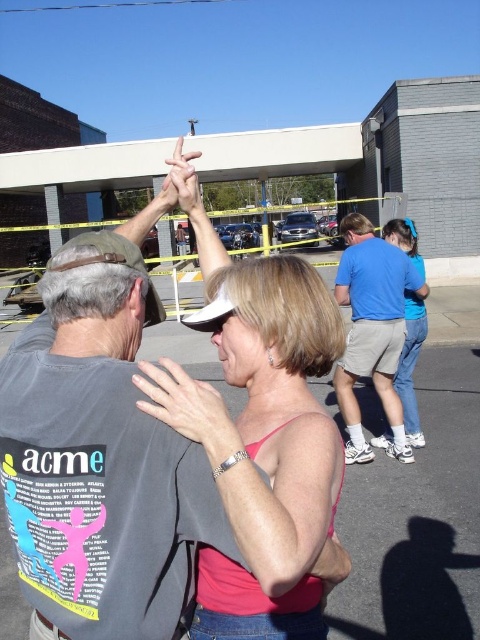
Question: Is pink fabric top at center smaller than smooth skin hand at center?

Choices:
 (A) no
 (B) yes

Answer: (A)

Question: Which point is closer to the camera taking this photo?

Choices:
 (A) (305, 531)
 (B) (160, 480)

Answer: (A)

Question: Is pink fabric top at center wider than matte white hand at center?

Choices:
 (A) no
 (B) yes

Answer: (A)

Question: Does blue cotton shirt at center have a larger size compared to matte white hand at center?

Choices:
 (A) yes
 (B) no

Answer: (B)

Question: Which of the following is the closest to the observer?

Choices:
 (A) pink matte tank top at center
 (B) matte white hand at center

Answer: (A)

Question: Which object appears closest to the camera in this image?

Choices:
 (A) matte white hand at center
 (B) pink matte tank top at center
 (C) blue cotton shirt at center
 (D) pink fabric top at center

Answer: (D)